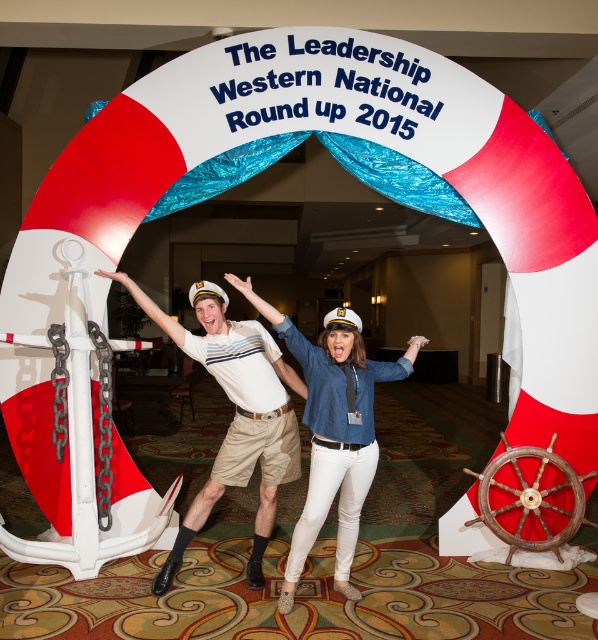
Question: Is white cotton shirt at center above denim shirt at center?

Choices:
 (A) yes
 (B) no

Answer: (A)

Question: Is white cotton shirt at center below denim shirt at center?

Choices:
 (A) yes
 (B) no

Answer: (B)

Question: Is white cotton shirt at center positioned before denim shirt at center?

Choices:
 (A) yes
 (B) no

Answer: (B)

Question: Which point appears farthest from the camera in this image?

Choices:
 (A) (346, 428)
 (B) (242, 445)

Answer: (B)

Question: Among these objects, which one is farthest from the camera?

Choices:
 (A) white cotton shirt at center
 (B) denim shirt at center

Answer: (A)

Question: Which point is closer to the camera?

Choices:
 (A) (169, 330)
 (B) (324, 344)

Answer: (B)